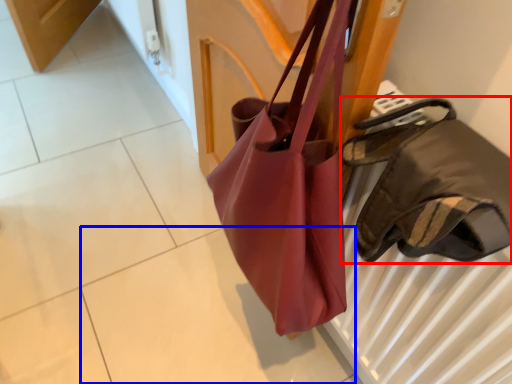
Question: Among these objects, which one is farthest to the camera, handbag (highlighted by a red box) or tile (highlighted by a blue box)?

Choices:
 (A) handbag
 (B) tile

Answer: (B)